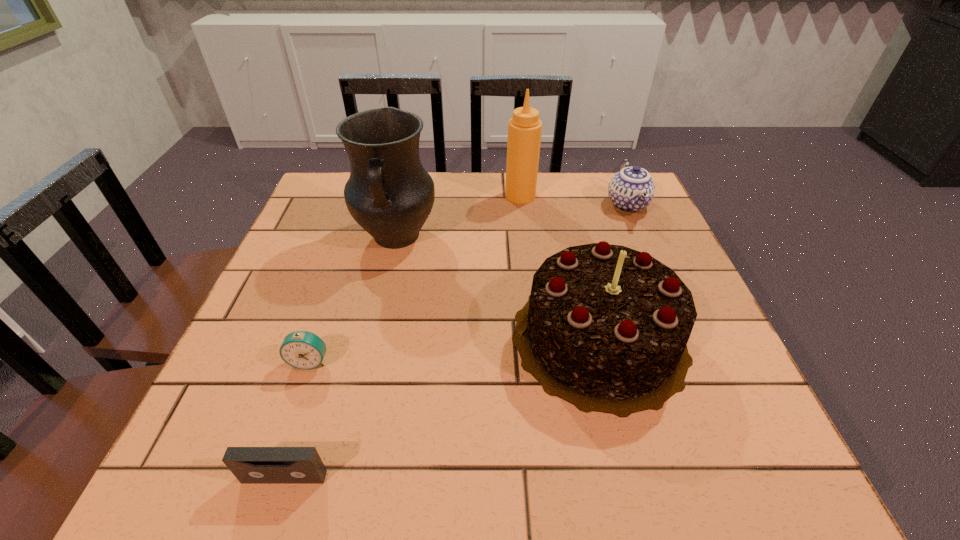
At what (x,y) coordinates should I click in order to perform the action: click on condiment. Please return your answer as a coordinate pair (x, y). Looking at the image, I should click on (525, 128).

Locate an element on the screen. pitcher is located at coordinates (389, 194).

You are a GUI agent. You are given a task and a screenshot of the screen. Output one action in this format:
    pyautogui.click(x=<x>, y=<y>)
    Task: Click on the third tallest object
    
    Given the screenshot: What is the action you would take?
    pyautogui.click(x=605, y=328)

Locate an element on the screen. The image size is (960, 540). the third shortest object is located at coordinates (631, 189).

Locate an element on the screen. The width and height of the screenshot is (960, 540). alarm clock is located at coordinates (304, 350).

Where is `videotape`? This screenshot has width=960, height=540. videotape is located at coordinates (250, 465).

Locate an element on the screen. The width and height of the screenshot is (960, 540). vacant space located on the left of the condiment is located at coordinates (484, 195).

Where is `vacant point located on the handle side of the pitcher`? The width and height of the screenshot is (960, 540). vacant point located on the handle side of the pitcher is located at coordinates (354, 422).

Find the location of a particular element. This screenshot has width=960, height=540. vacant space located 0.080m on the back of the fourth shortest object is located at coordinates (579, 255).

Identify the location of blank space located 0.300m from the spout of the fourth tallest object. The height and width of the screenshot is (540, 960). (674, 312).